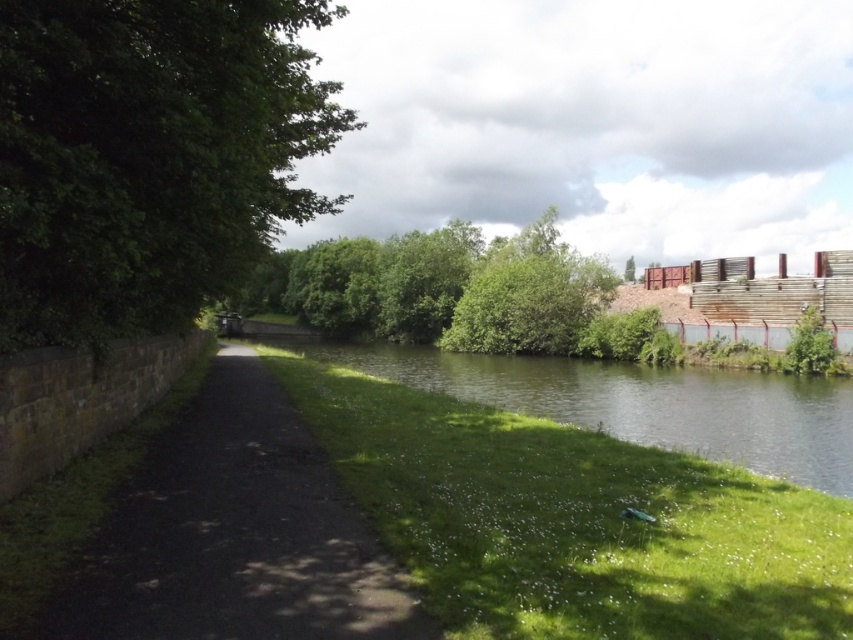
Question: Which point is closer to the camera?

Choices:
 (A) dark asphalt path at center
 (B) green grassy bank at lower center
 (C) green leafy tree at center
 (D) green leafy tree at left

Answer: (A)

Question: Which object is positioned closest to the green leafy tree at center?

Choices:
 (A) dark asphalt path at center
 (B) green grassy bank at lower center

Answer: (B)

Question: Does green leafy tree at left appear on the left side of green leafy tree at center?

Choices:
 (A) no
 (B) yes

Answer: (B)

Question: Can you confirm if dark asphalt path at center is positioned above green leafy tree at upper right?

Choices:
 (A) no
 (B) yes

Answer: (A)

Question: Which of the following is the closest to the observer?

Choices:
 (A) green grassy bank at lower center
 (B) green leafy tree at upper right

Answer: (A)

Question: Can you confirm if dark asphalt path at center is bigger than green leafy tree at center?

Choices:
 (A) yes
 (B) no

Answer: (B)